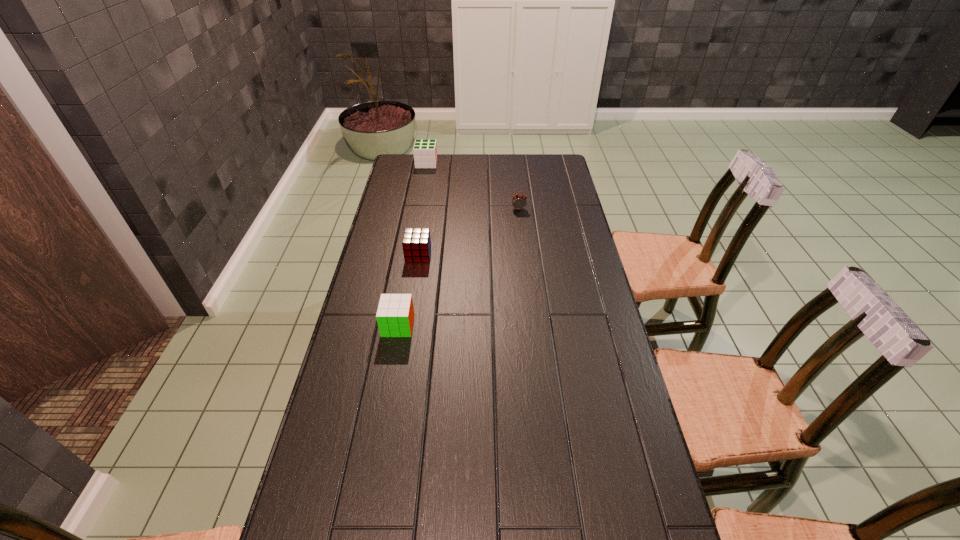
The height and width of the screenshot is (540, 960). In order to click on free space between the farthest cube and the alarm clock in this screenshot , I will do `click(472, 186)`.

The height and width of the screenshot is (540, 960). What are the coordinates of `unoccupied area between the second nearest object and the farthest object` in the screenshot? It's located at (422, 209).

Image resolution: width=960 pixels, height=540 pixels. Find the location of `object that is the second closest to the nearest cube`. object that is the second closest to the nearest cube is located at coordinates (519, 201).

This screenshot has width=960, height=540. In order to click on object that ranks as the third closest to the third farthest object in this screenshot , I will do `click(425, 151)`.

What are the coordinates of `the closest cube to the farthest object` in the screenshot? It's located at (416, 243).

The width and height of the screenshot is (960, 540). Find the location of `cube object that ranks as the closest to the second nearest object`. cube object that ranks as the closest to the second nearest object is located at coordinates (395, 314).

The width and height of the screenshot is (960, 540). I want to click on free space that satisfies the following two spatial constraints: 1. on the back side of the nearest cube; 2. on the left side of the second nearest object, so click(411, 254).

The image size is (960, 540). I want to click on vacant space that satisfies the following two spatial constraints: 1. on the red face of the farthest object; 2. on the back side of the second nearest cube, so click(x=410, y=254).

Where is `free space in the image that satisfies the following two spatial constraints: 1. on the back side of the second farthest cube; 2. on the red face of the farthest cube`? Image resolution: width=960 pixels, height=540 pixels. free space in the image that satisfies the following two spatial constraints: 1. on the back side of the second farthest cube; 2. on the red face of the farthest cube is located at coordinates (433, 164).

The image size is (960, 540). Find the location of `vacant area in the image that satisfies the following two spatial constraints: 1. on the back side of the third farthest object; 2. on the left side of the nearest cube`. vacant area in the image that satisfies the following two spatial constraints: 1. on the back side of the third farthest object; 2. on the left side of the nearest cube is located at coordinates (411, 254).